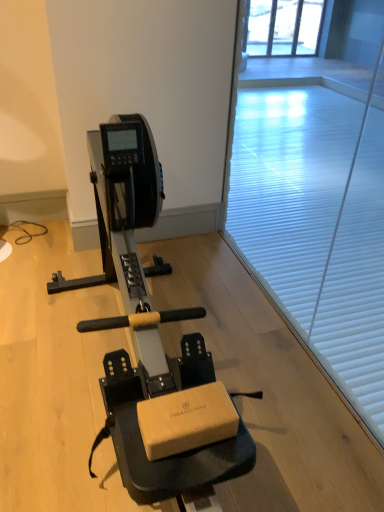
Question: From the image's perspective, is white matte window screen at center over matte black stationary bicycle at center?

Choices:
 (A) no
 (B) yes

Answer: (B)

Question: Does white matte window screen at center come in front of matte black stationary bicycle at center?

Choices:
 (A) no
 (B) yes

Answer: (A)

Question: Does white matte window screen at center have a greater height compared to matte black stationary bicycle at center?

Choices:
 (A) yes
 (B) no

Answer: (A)

Question: Is white matte window screen at center to the right of matte black stationary bicycle at center from the viewer's perspective?

Choices:
 (A) no
 (B) yes

Answer: (B)

Question: Is white matte window screen at center looking in the opposite direction of matte black stationary bicycle at center?

Choices:
 (A) no
 (B) yes

Answer: (B)

Question: Is white matte window screen at center placed right next to matte black stationary bicycle at center?

Choices:
 (A) no
 (B) yes

Answer: (A)

Question: Can you see matte black stationary bicycle at center touching white matte window screen at center?

Choices:
 (A) no
 (B) yes

Answer: (A)

Question: Is matte black stationary bicycle at center closer to camera compared to white matte window screen at center?

Choices:
 (A) yes
 (B) no

Answer: (A)

Question: From a real-world perspective, does matte black stationary bicycle at center sit lower than white matte window screen at center?

Choices:
 (A) yes
 (B) no

Answer: (A)

Question: Is white matte window screen at center located within matte black stationary bicycle at center?

Choices:
 (A) no
 (B) yes

Answer: (A)

Question: Considering the relative sizes of matte black stationary bicycle at center and white matte window screen at center in the image provided, is matte black stationary bicycle at center shorter than white matte window screen at center?

Choices:
 (A) yes
 (B) no

Answer: (A)

Question: Does matte black stationary bicycle at center have a lesser width compared to white matte window screen at center?

Choices:
 (A) no
 (B) yes

Answer: (A)

Question: Considering the relative positions of matte black stationary bicycle at center and white matte window screen at center in the image provided, is matte black stationary bicycle at center to the left or to the right of white matte window screen at center?

Choices:
 (A) left
 (B) right

Answer: (A)